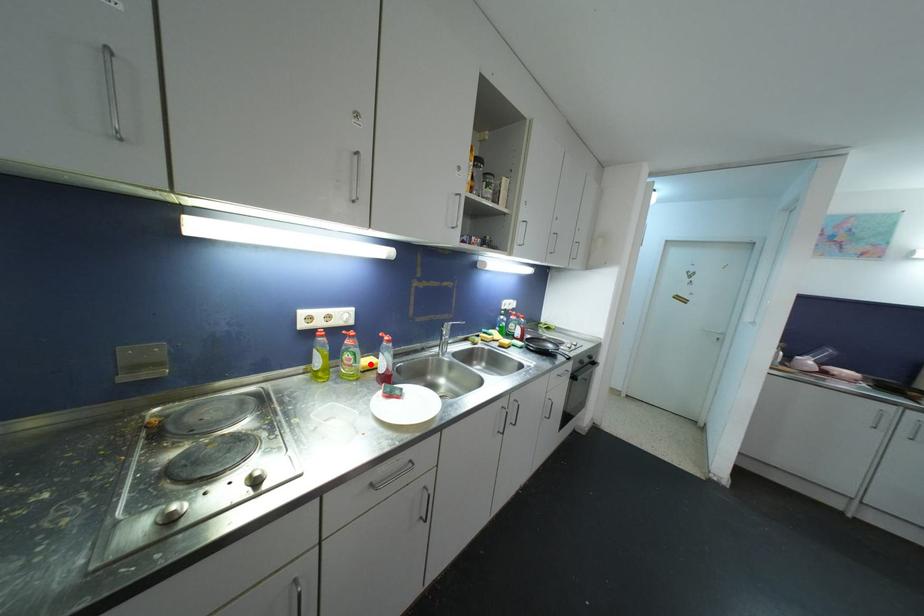
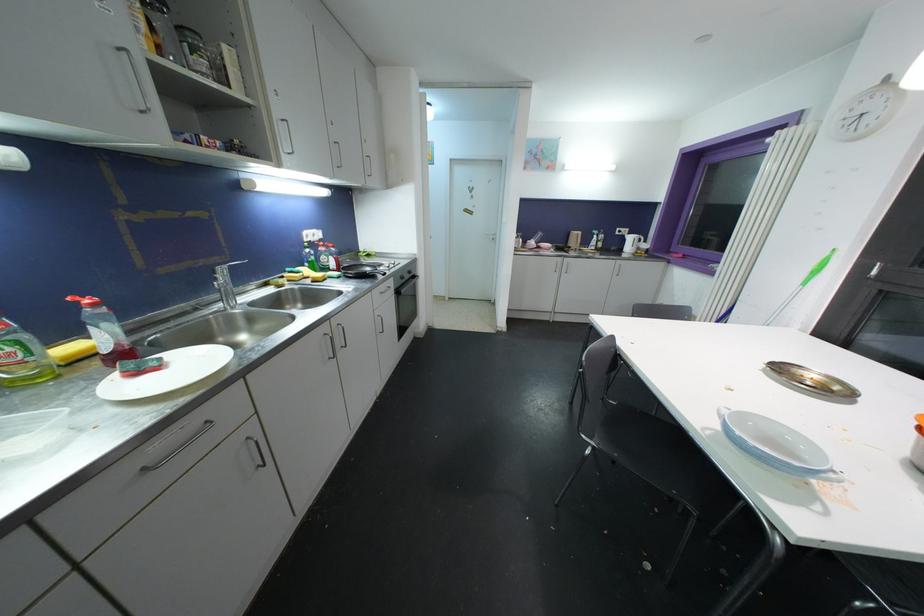
Locate, in the second image, the point that corresponds to the highlighted location in the first image.

(69, 350)